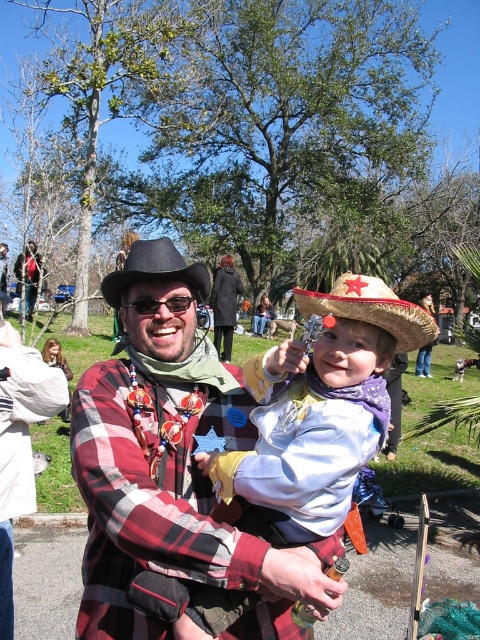
What do you see at coordinates (372, 308) in the screenshot?
I see `glittery straw hat at center` at bounding box center [372, 308].

Is glittery straw hat at center further to camera compared to black felt cowboy hat at center?

No.

Who is more distant from viewer, (350, 305) or (194, 278)?

Point (194, 278)

Locate an element on the screen. The width and height of the screenshot is (480, 640). glittery straw hat at center is located at coordinates (372, 308).

Does plaid fabric shirt at center appear over glittery straw hat at center?

Incorrect, plaid fabric shirt at center is not positioned above glittery straw hat at center.

Does plaid fabric shirt at center have a smaller size compared to glittery straw hat at center?

Yes.

Locate an element on the screen. The height and width of the screenshot is (640, 480). plaid fabric shirt at center is located at coordinates (172, 465).

Based on the photo, is plaid fabric shirt at center above black felt cowboy hat at center?

No, plaid fabric shirt at center is not above black felt cowboy hat at center.

Is plaid fabric shirt at center closer to the viewer compared to black felt cowboy hat at center?

That is True.

Is point (252, 538) closer to viewer compared to point (129, 285)?

Yes.

The height and width of the screenshot is (640, 480). What are the coordinates of `plaid fabric shirt at center` in the screenshot? It's located at (172, 465).